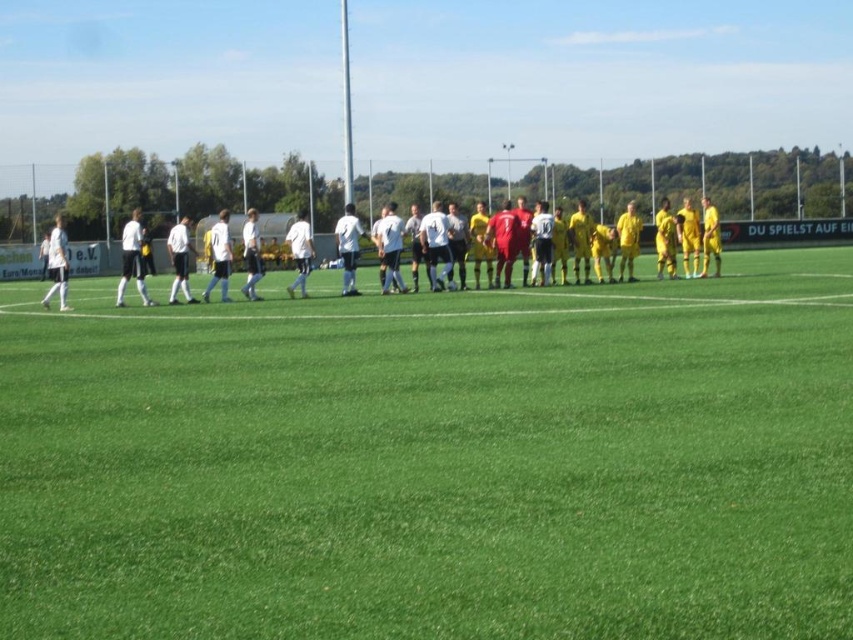
Which of these two, green grass field at center or white matte soccer team at center, stands taller?

white matte soccer team at center

Is green grass field at center above white matte soccer team at center?

No, green grass field at center is not above white matte soccer team at center.

Does point (828, 454) come in front of point (519, 230)?

Yes, point (828, 454) is in front of point (519, 230).

Locate an element on the screen. This screenshot has height=640, width=853. green grass field at center is located at coordinates (436, 461).